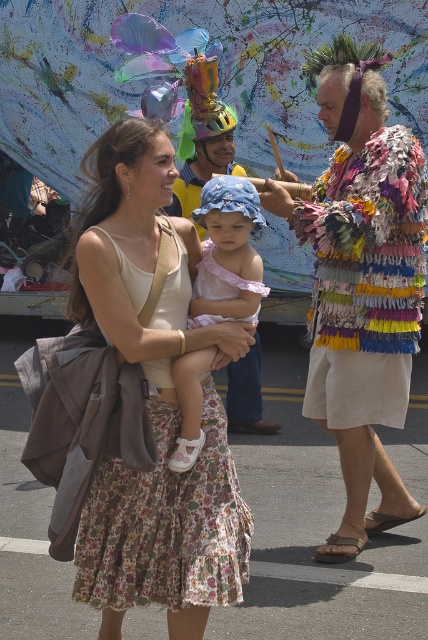
Question: Is floral cotton dress at center to the left of matte pink fabric dress at center from the viewer's perspective?

Choices:
 (A) no
 (B) yes

Answer: (B)

Question: Which point is farther to the camera?

Choices:
 (A) floral cotton dress at center
 (B) matte pink fabric dress at center

Answer: (B)

Question: Which object appears farthest from the camera in this image?

Choices:
 (A) floral cotton dress at center
 (B) matte pink fabric dress at center

Answer: (B)

Question: Observing the image, what is the correct spatial positioning of floral cotton dress at center in reference to matte pink fabric dress at center?

Choices:
 (A) right
 (B) left

Answer: (B)

Question: Among these points, which one is nearest to the camera?

Choices:
 (A) (165, 182)
 (B) (223, 291)

Answer: (A)

Question: Is the position of floral cotton dress at center less distant than that of matte pink fabric dress at center?

Choices:
 (A) no
 (B) yes

Answer: (B)